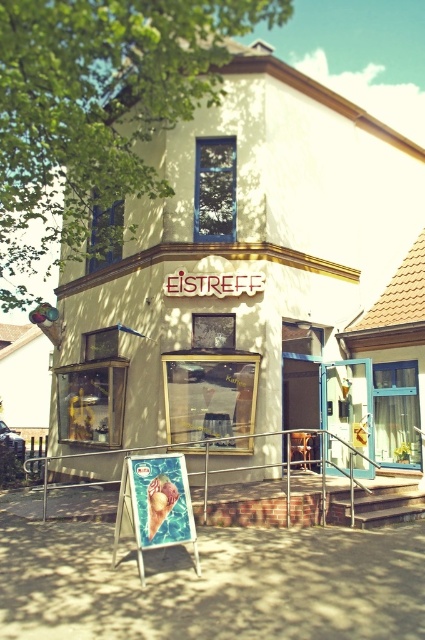
You are designing a new sign for the ice cream shop and need to place it between the white matte storefront at center and the metallic silver rail at center. Which object should the sign be closer to if you want it to be near the wider structure?

The white matte storefront at center is wider than the metallic silver rail at center, so the sign should be placed closer to the white matte storefront at center.

You are standing in front of the ice cream shop and want to enter. You notice the white matte storefront at center and the metallic ice cream cone at center. Which object is closer to you?

The white matte storefront at center is closer to you than the metallic ice cream cone at center.

You are standing in front of the EISTREFF ice cream shop. There is a point marked at coordinates (238, 276). Based on the scene description, what does this point most likely represent?

The point at coordinates (238, 276) most likely represents the white matte storefront at center, as indicated by the Objects Description.